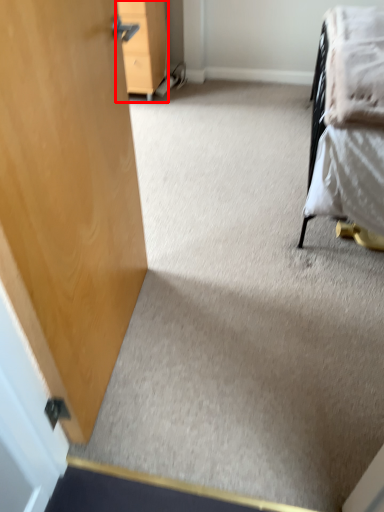
Question: Where is furniture (annotated by the red box) located in relation to blanket in the image?

Choices:
 (A) left
 (B) right

Answer: (A)